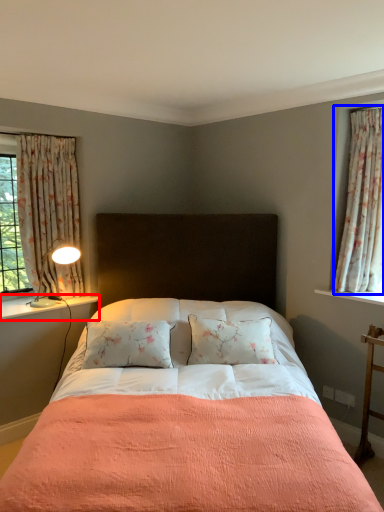
Question: Which object appears closest to the camera in this image, window sill (highlighted by a red box) or curtain (highlighted by a blue box)?

Choices:
 (A) window sill
 (B) curtain

Answer: (B)